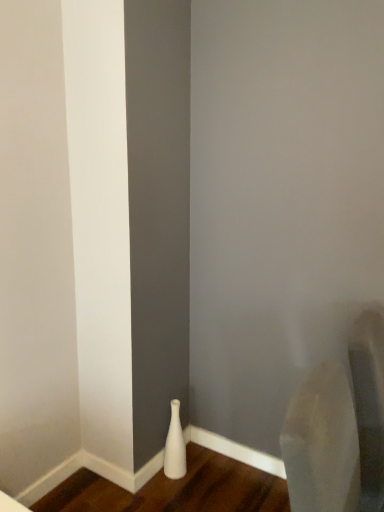
Locate an element on the screen. The image size is (384, 512). free space behind white glossy vase at lower left is located at coordinates (193, 452).